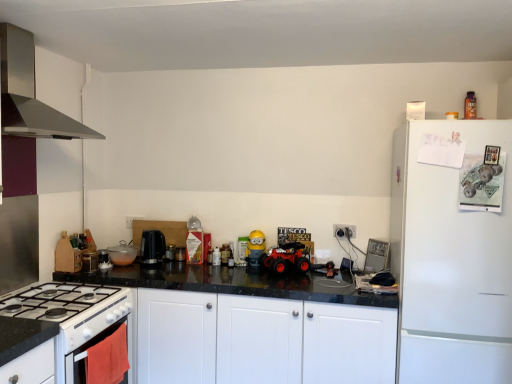
Question: From the image's perspective, is white matte refrigerator at right located beneath black plastic coffee machine at center?

Choices:
 (A) no
 (B) yes

Answer: (B)

Question: Can you confirm if white matte refrigerator at right is positioned to the right of black plastic coffee machine at center?

Choices:
 (A) no
 (B) yes

Answer: (B)

Question: Is white matte refrigerator at right at the left side of black plastic coffee machine at center?

Choices:
 (A) no
 (B) yes

Answer: (A)

Question: Considering the relative sizes of white matte refrigerator at right and black plastic coffee machine at center in the image provided, is white matte refrigerator at right taller than black plastic coffee machine at center?

Choices:
 (A) no
 (B) yes

Answer: (B)

Question: Considering the relative sizes of white matte refrigerator at right and black plastic coffee machine at center in the image provided, is white matte refrigerator at right thinner than black plastic coffee machine at center?

Choices:
 (A) yes
 (B) no

Answer: (B)

Question: Is white glossy gas stove at lower left taller or shorter than translucent glass bowl at center, the 2th kitchen appliance positioned from the top?

Choices:
 (A) tall
 (B) short

Answer: (A)

Question: From the image's perspective, is white glossy gas stove at lower left above or below translucent glass bowl at center, the first kitchen appliance when ordered from bottom to top?

Choices:
 (A) above
 (B) below

Answer: (B)

Question: In terms of size, does white glossy gas stove at lower left appear bigger or smaller than translucent glass bowl at center, which is counted as the second kitchen appliance, starting from the front?

Choices:
 (A) big
 (B) small

Answer: (A)

Question: Is point (51, 286) positioned closer to the camera than point (132, 253)?

Choices:
 (A) closer
 (B) farther

Answer: (A)

Question: Is matte red plastic toy car at center bigger or smaller than white glossy gas stove at lower left?

Choices:
 (A) big
 (B) small

Answer: (B)

Question: Which is correct: matte red plastic toy car at center is inside white glossy gas stove at lower left, or outside of it?

Choices:
 (A) inside
 (B) outside

Answer: (B)

Question: Considering their positions, is matte red plastic toy car at center located in front of or behind white glossy gas stove at lower left?

Choices:
 (A) behind
 (B) front

Answer: (A)

Question: In terms of width, does matte red plastic toy car at center look wider or thinner when compared to white glossy gas stove at lower left?

Choices:
 (A) wide
 (B) thin

Answer: (B)

Question: Is point (74, 319) positioned closer to the camera than point (178, 254)?

Choices:
 (A) closer
 (B) farther

Answer: (A)

Question: Considering the positions of white glossy oven at lower left and metallic black kettle at center, which is the 1th appliance from right to left, in the image, is white glossy oven at lower left wider or thinner than metallic black kettle at center, which is the 1th appliance from right to left,?

Choices:
 (A) thin
 (B) wide

Answer: (B)